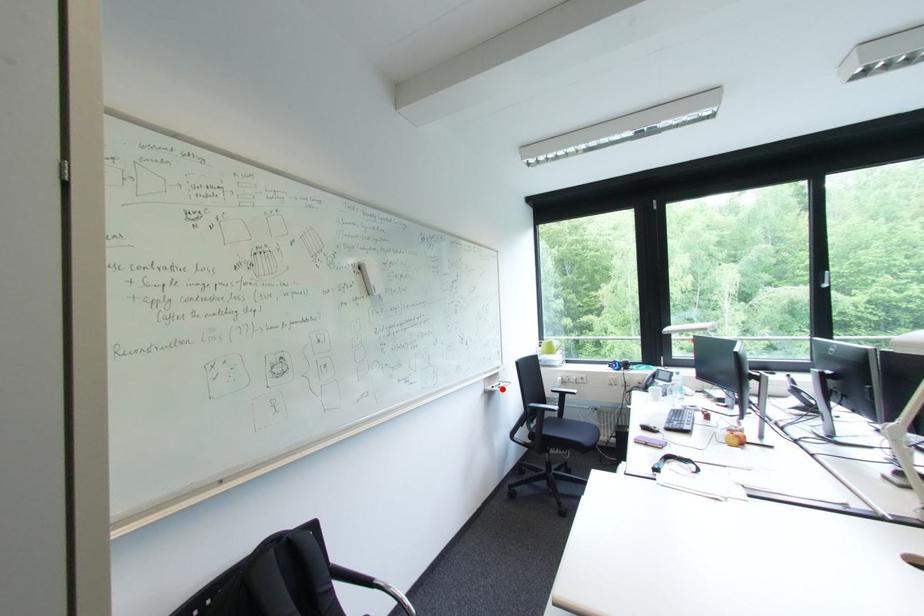
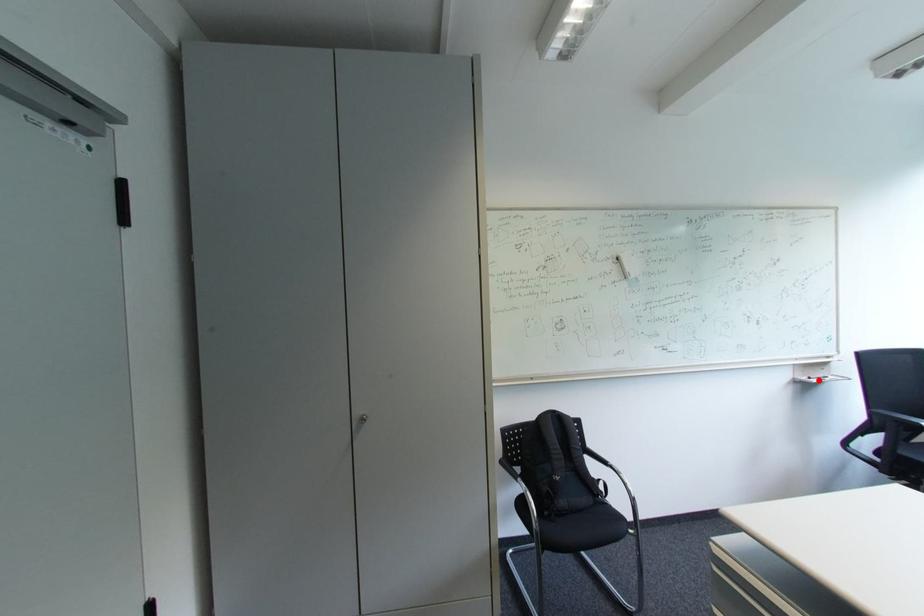
I am providing you with two images of the same scene from different viewpoints. A red point is marked on the first image and another point is marked on the second image. Does the point marked in image1 correspond to the same location as the one in image2?

Yes